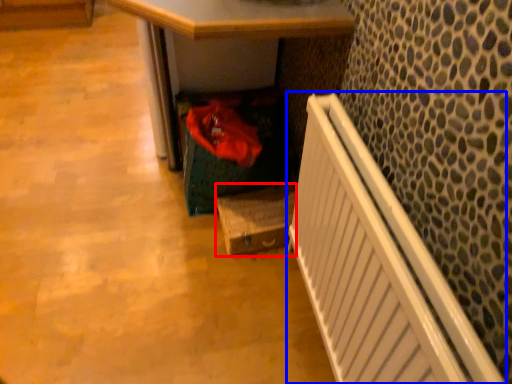
Question: Which object is further to the camera taking this photo, box (highlighted by a red box) or radiator (highlighted by a blue box)?

Choices:
 (A) box
 (B) radiator

Answer: (A)